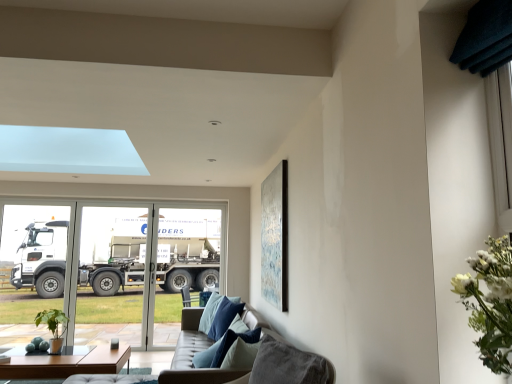
Question: From a real-world perspective, is blue velvet pillow at center on top of transparent glass screen door at center, the 1th screen door viewed from the right?

Choices:
 (A) yes
 (B) no

Answer: (B)

Question: Is blue velvet pillow at center at the right side of transparent glass screen door at center, the 2th screen door viewed from the left?

Choices:
 (A) yes
 (B) no

Answer: (A)

Question: Considering the relative positions of blue velvet pillow at center and transparent glass screen door at center, the 1th screen door viewed from the right, in the image provided, is blue velvet pillow at center to the left of transparent glass screen door at center, the 1th screen door viewed from the right, from the viewer's perspective?

Choices:
 (A) no
 (B) yes

Answer: (A)

Question: From the image's perspective, is blue velvet pillow at center below transparent glass screen door at center, the 1th screen door viewed from the right?

Choices:
 (A) yes
 (B) no

Answer: (B)

Question: From a real-world perspective, is blue velvet pillow at center positioned under transparent glass screen door at center, the 2th screen door viewed from the left, based on gravity?

Choices:
 (A) yes
 (B) no

Answer: (A)

Question: Does blue velvet pillow at center touch transparent glass screen door at center, the 2th screen door viewed from the left?

Choices:
 (A) no
 (B) yes

Answer: (A)

Question: From the image's perspective, is transparent glass screen door at left, the second screen door from the right, beneath white metallic truck at left?

Choices:
 (A) no
 (B) yes

Answer: (A)

Question: Is transparent glass screen door at left, marked as the 1th screen door in a left-to-right arrangement, facing away from white metallic truck at left?

Choices:
 (A) yes
 (B) no

Answer: (A)

Question: Does transparent glass screen door at left, the second screen door from the right, lie behind white metallic truck at left?

Choices:
 (A) no
 (B) yes

Answer: (B)

Question: Is the position of transparent glass screen door at left, the second screen door from the right, less distant than that of white metallic truck at left?

Choices:
 (A) no
 (B) yes

Answer: (A)

Question: Could you tell me if transparent glass screen door at left, the second screen door from the right, is facing white metallic truck at left?

Choices:
 (A) yes
 (B) no

Answer: (A)

Question: Can you confirm if transparent glass screen door at left, marked as the 1th screen door in a left-to-right arrangement, is positioned to the left of white metallic truck at left?

Choices:
 (A) yes
 (B) no

Answer: (A)

Question: Considering the relative sizes of transparent glass screen door at left, the second screen door from the right, and blue velvet pillow at center in the image provided, is transparent glass screen door at left, the second screen door from the right, bigger than blue velvet pillow at center?

Choices:
 (A) yes
 (B) no

Answer: (A)